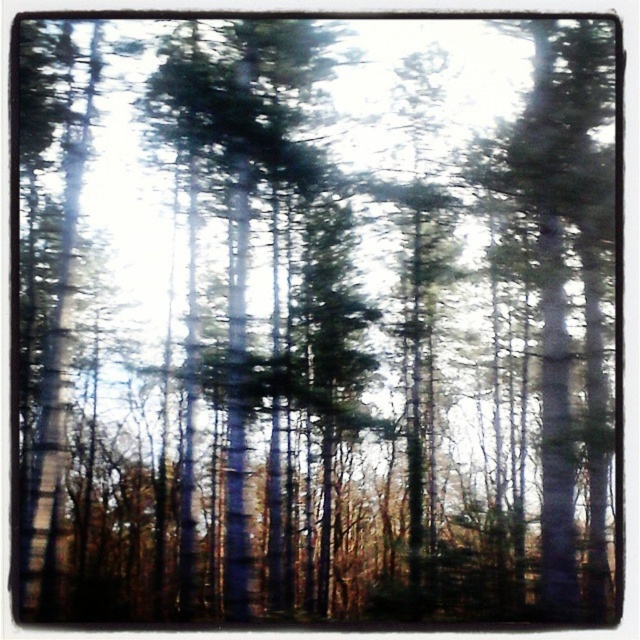
Question: Which point is farther to the camera?

Choices:
 (A) green matte tree at right
 (B) green matte tree at center

Answer: (B)

Question: Does green matte tree at center have a lesser width compared to green matte tree at right?

Choices:
 (A) yes
 (B) no

Answer: (B)

Question: Is green matte tree at center below green matte tree at right?

Choices:
 (A) no
 (B) yes

Answer: (A)

Question: Can you confirm if green matte tree at center is positioned to the left of green matte tree at right?

Choices:
 (A) yes
 (B) no

Answer: (A)